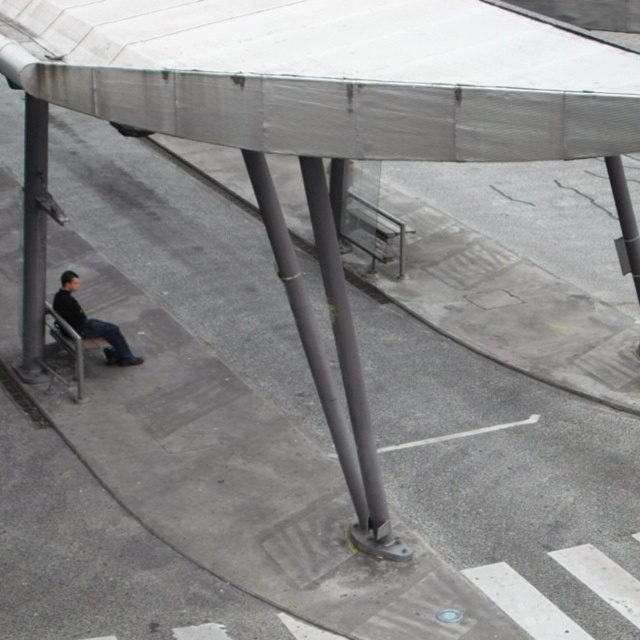
Between gray metallic pole at center and gray metallic pole at left, which one has more height?

With more height is gray metallic pole at center.

Does gray metallic pole at center have a smaller size compared to gray metallic pole at left?

Actually, gray metallic pole at center might be larger than gray metallic pole at left.

Between point (374, 472) and point (26, 209), which one is positioned in front?

Point (374, 472) is more forward.

At what (x,y) coordinates should I click in order to perform the action: click on gray metallic pole at center. Please return your answer as a coordinate pair (x, y). Image resolution: width=640 pixels, height=640 pixels. Looking at the image, I should click on (348, 362).

Does gray metallic pole at left appear under dark gray leather jacket at lower left?

No, gray metallic pole at left is not below dark gray leather jacket at lower left.

Is point (44, 163) behind point (67, 296)?

No, (44, 163) is closer to viewer.

Is point (29, 336) positioned behind point (120, 330)?

No, (29, 336) is in front of (120, 330).

Find the location of `gray metallic pole at left`. gray metallic pole at left is located at coordinates (33, 236).

Does gray metallic pole at center have a larger size compared to smooth gray pole at center?

Yes.

Looking at this image, is gray metallic pole at center to the left of smooth gray pole at center from the viewer's perspective?

Incorrect, gray metallic pole at center is not on the left side of smooth gray pole at center.

This screenshot has height=640, width=640. I want to click on gray metallic pole at center, so click(x=348, y=362).

The width and height of the screenshot is (640, 640). Identify the location of gray metallic pole at center. (348, 362).